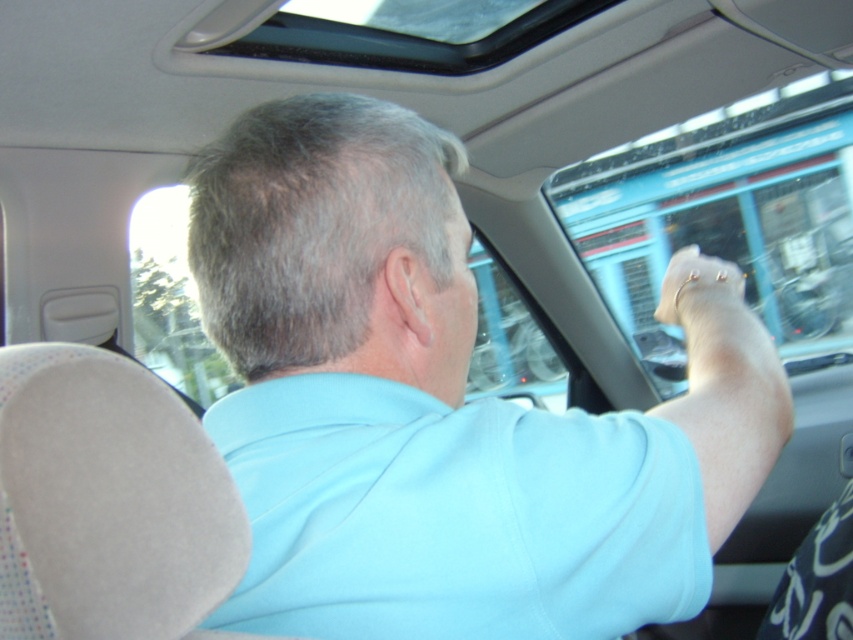
Is the position of light blue shirt at center more distant than that of light blue cotton shirt at upper center?

Yes.

In the scene shown: Is light blue shirt at center bigger than light blue cotton shirt at upper center?

Yes.

Find the location of a particular element. light blue shirt at center is located at coordinates (434, 410).

Which is in front, point (432, 506) or point (718, 317)?

Point (432, 506) is more forward.

Based on the photo, between light blue shirt at center and gold metallic bracelet at upper center, which one has more height?

With more height is light blue shirt at center.

Which is behind, point (724, 454) or point (708, 268)?

Point (708, 268)

Find the location of a particular element. Image resolution: width=853 pixels, height=640 pixels. light blue shirt at center is located at coordinates (434, 410).

Does light blue shirt at center appear on the right side of transparent glass window at upper center?

Incorrect, light blue shirt at center is not on the right side of transparent glass window at upper center.

Is light blue shirt at center positioned before transparent glass window at upper center?

Yes.

Where is `light blue shirt at center`? The height and width of the screenshot is (640, 853). light blue shirt at center is located at coordinates (434, 410).